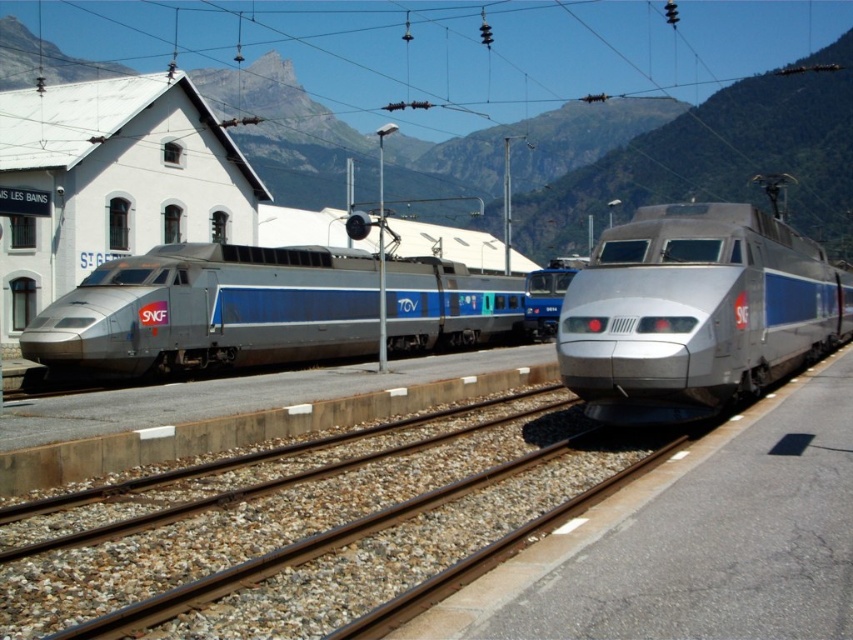
Question: Which point is closer to the camera?

Choices:
 (A) (764, 243)
 (B) (30, 339)

Answer: (A)

Question: In this image, where is metallic silver train at center located relative to silver metallic bullet train at center?

Choices:
 (A) right
 (B) left

Answer: (B)

Question: Is metallic silver train at center to the left of silver metallic bullet train at center from the viewer's perspective?

Choices:
 (A) yes
 (B) no

Answer: (A)

Question: Does metallic silver train at center appear over silver metallic bullet train at center?

Choices:
 (A) no
 (B) yes

Answer: (B)